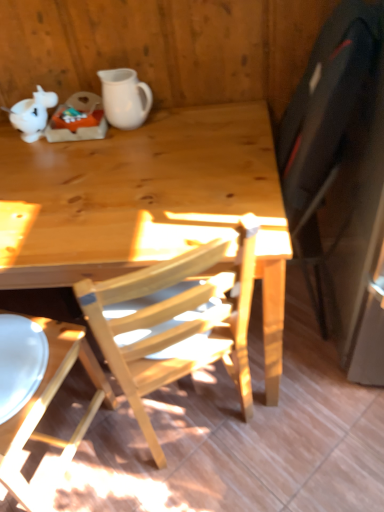
Question: From the image's perspective, relative to wooden chair at lower left, is white matte teapot at upper left above or below?

Choices:
 (A) above
 (B) below

Answer: (A)

Question: In the image, is white matte teapot at upper left positioned in front of or behind wooden chair at lower left?

Choices:
 (A) front
 (B) behind

Answer: (B)

Question: Based on their relative distances, which object is farther from the natural wood desk at center?

Choices:
 (A) wooden chair at lower left
 (B) white matte pitcher at upper left
 (C) white matte teapot at upper left

Answer: (C)

Question: Based on their relative distances, which object is farther from the wooden chair at lower left?

Choices:
 (A) natural wood desk at center
 (B) white matte teapot at upper left
 (C) white matte pitcher at upper left

Answer: (C)